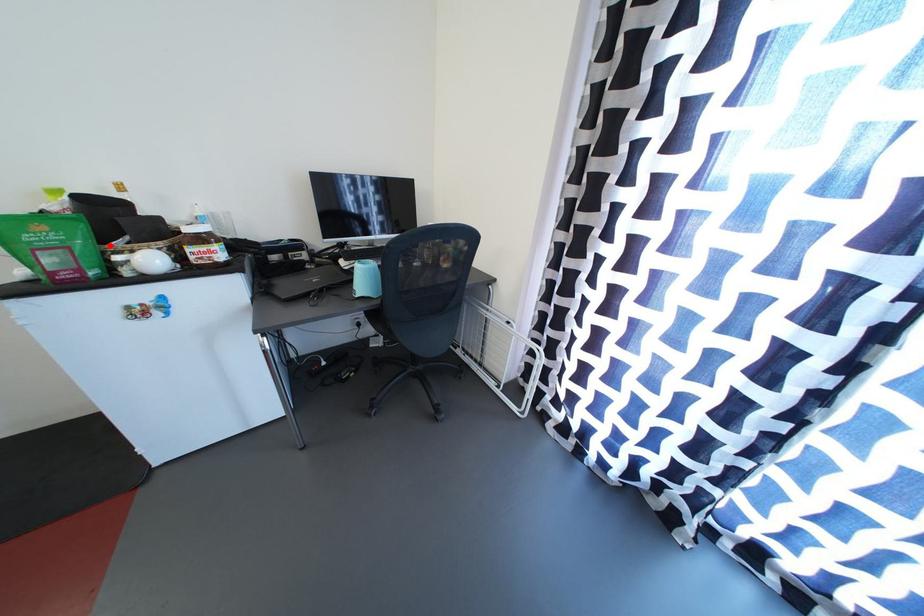
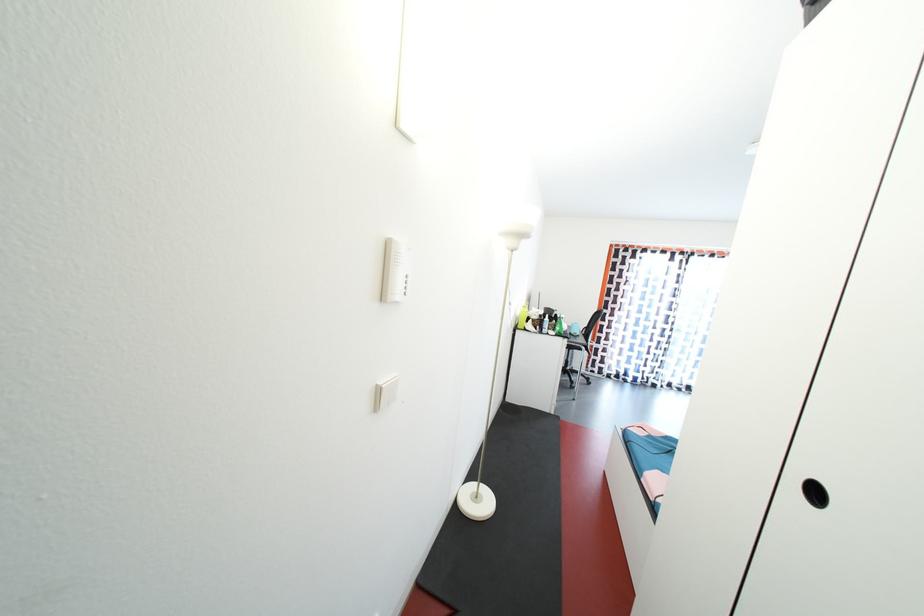
Question: I am providing you with two images of the same scene from different viewpoints. A red point is marked on the first image. Can you still see the location of the red point in image 2?

Choices:
 (A) Yes
 (B) No

Answer: (B)